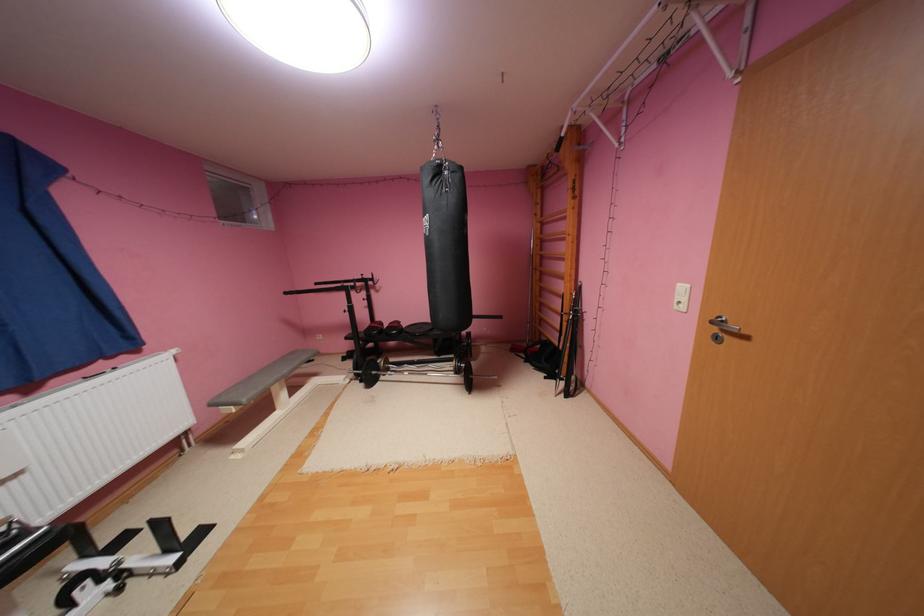
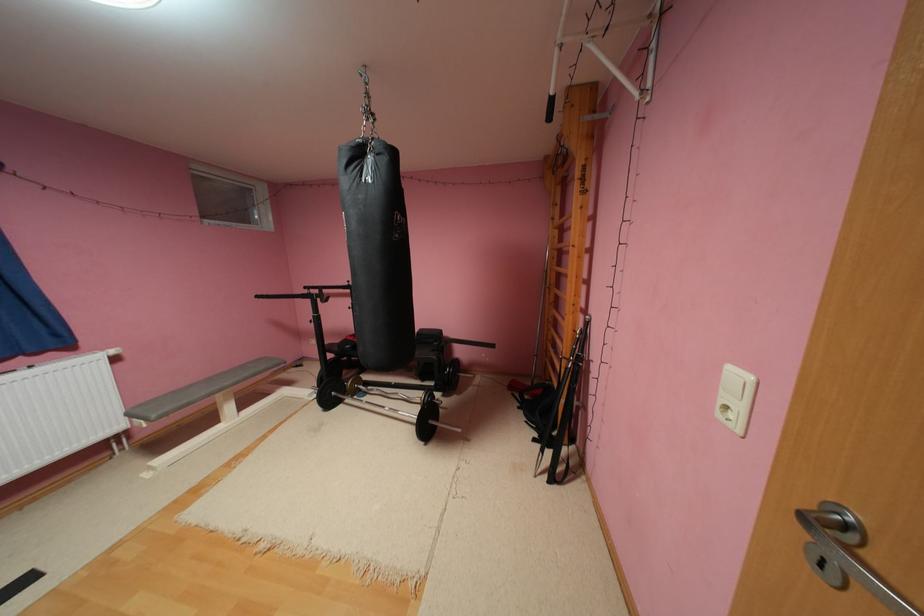
Question: The camera is either moving clockwise (left) or counter-clockwise (right) around the object. The first image is from the beginning of the video and the second image is from the end. Is the camera moving left or right when shooting the video?

Choices:
 (A) Left
 (B) Right

Answer: (B)